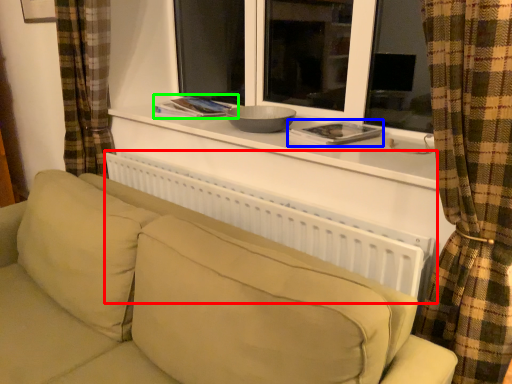
Question: Which is farther away from radiator (highlighted by a red box)? book (highlighted by a blue box) or book (highlighted by a green box)?

Choices:
 (A) book
 (B) book

Answer: (B)